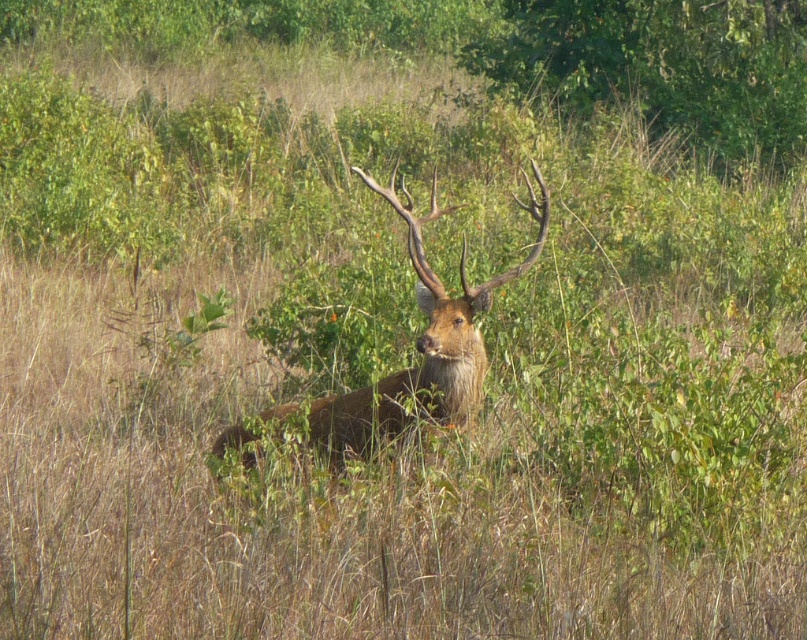
Question: Is green leafy bush at upper center in front of brown furry deer at center?

Choices:
 (A) yes
 (B) no

Answer: (B)

Question: Is green leafy bush at upper center above brown furry deer at center?

Choices:
 (A) yes
 (B) no

Answer: (A)

Question: Among these objects, which one is farthest from the camera?

Choices:
 (A) green leafy bush at upper center
 (B) brown furry deer at center

Answer: (A)

Question: Does green leafy bush at upper center have a smaller size compared to brown furry deer at center?

Choices:
 (A) no
 (B) yes

Answer: (A)